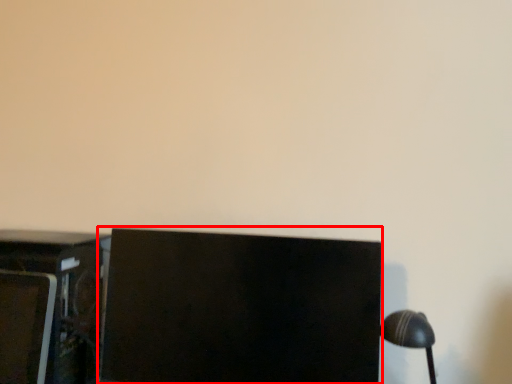
Question: From the image's perspective, where is computer monitor (annotated by the red box) located in relation to furniture in the image?

Choices:
 (A) below
 (B) above

Answer: (B)